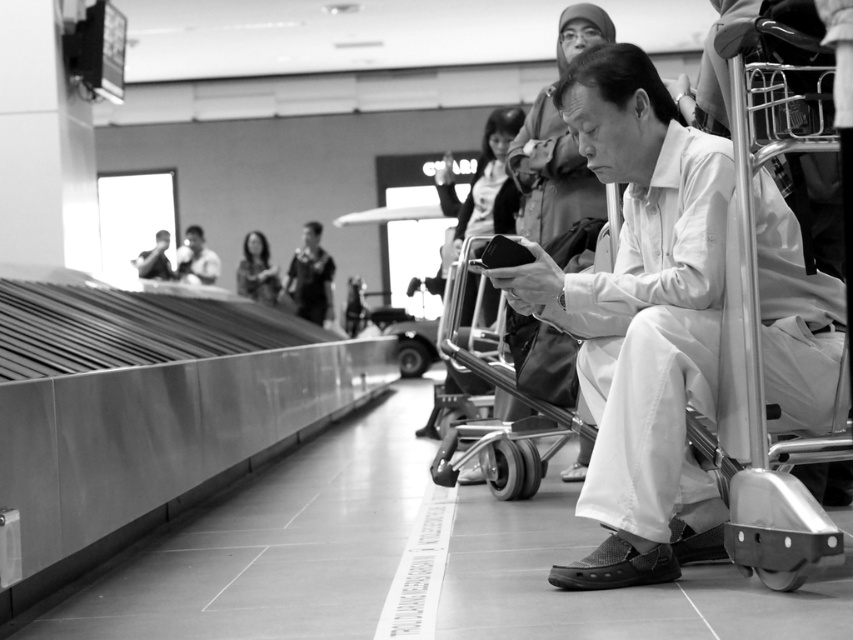
Is smooth skin face at upper left above smooth black bag at center?

Correct, smooth skin face at upper left is located above smooth black bag at center.

Is point (195, 278) in front of point (163, 252)?

No, (195, 278) is further to viewer.

Locate an element on the screen. smooth skin face at upper left is located at coordinates (196, 259).

Locate an element on the screen. The height and width of the screenshot is (640, 853). dark gray jacket at center is located at coordinates (311, 276).

Which is in front, point (305, 314) or point (213, 260)?

Positioned in front is point (305, 314).

Is point (303, 232) in front of point (194, 266)?

No, (303, 232) is further to viewer.

Locate an element on the screen. dark gray jacket at center is located at coordinates (311, 276).

Between dark gray jacket at center and smooth black bag at center, which one is positioned lower?

smooth black bag at center is below.

Which of these two, dark gray jacket at center or smooth black bag at center, stands shorter?

smooth black bag at center is shorter.

Who is more distant from viewer, (305, 248) or (148, 259)?

The point (305, 248) is more distant.

Identify the location of dark gray jacket at center. The image size is (853, 640). (x=311, y=276).